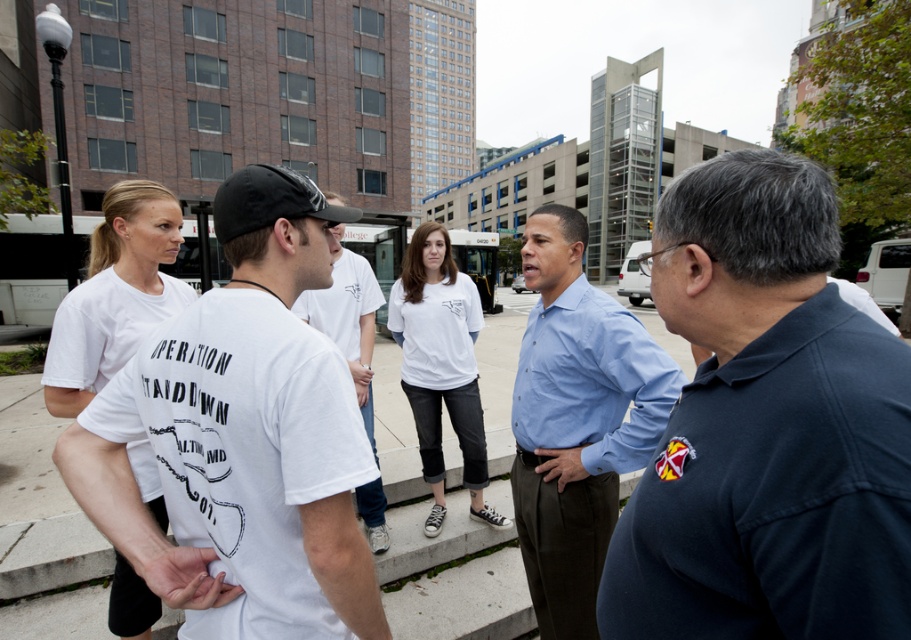
Between dark blue polo shirt at center and white cotton shirt at center, which one is positioned lower?

Positioned lower is white cotton shirt at center.

The height and width of the screenshot is (640, 911). Identify the location of dark blue polo shirt at center. (766, 428).

Based on the photo, who is more distant from viewer, [745,316] or [439,413]?

Point [439,413]

Identify the location of dark blue polo shirt at center. (766, 428).

Measure the distance between point [33,484] and camera.

A distance of 4.29 meters exists between point [33,484] and camera.

Can you confirm if concrete pavement at center is positioned above white cotton t-shirt at center?

No, concrete pavement at center is not above white cotton t-shirt at center.

The height and width of the screenshot is (640, 911). Describe the element at coordinates (53, 579) in the screenshot. I see `concrete pavement at center` at that location.

The image size is (911, 640). In order to click on concrete pavement at center in this screenshot , I will do `click(53, 579)`.

Which of these two, concrete pavement at center or light blue shirt at center, stands taller?

Standing taller between the two is concrete pavement at center.

Which is in front, point (498, 362) or point (610, 476)?

Point (610, 476) is in front.

You are a GUI agent. You are given a task and a screenshot of the screen. Output one action in this format:
    pyautogui.click(x=<x>, y=<y>)
    Task: Click on the concrete pavement at center
    
    Given the screenshot: What is the action you would take?
    pyautogui.click(x=53, y=579)